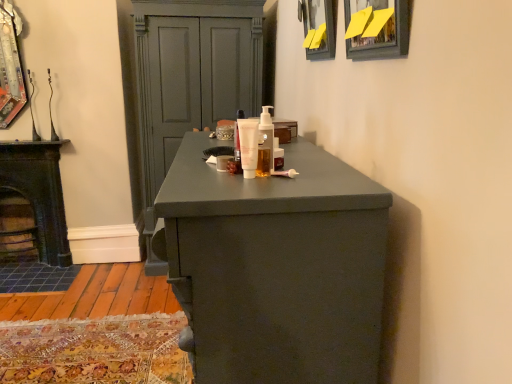
Question: Looking at their shapes, would you say black cast iron stove at left is wider or thinner than white matte tube at center?

Choices:
 (A) thin
 (B) wide

Answer: (B)

Question: Considering their positions, is black cast iron stove at left located in front of or behind white matte tube at center?

Choices:
 (A) behind
 (B) front

Answer: (A)

Question: Considering the real-world distances, which object is closest to the yellow paper at upper center, the second picture frame when ordered from back to front?

Choices:
 (A) white matte tube at center, the first mouthwash in the front-to-back sequence
 (B) white matte tube at center
 (C) matte gray chest of drawers at center
 (D) translucent plastic mouthwash at center, which is the 2th mouthwash from front to back
 (E) black cast iron stove at left

Answer: (D)

Question: Which object is positioned closest to the matte black picture frame at upper center, arranged as the 2th picture frame when viewed from the front?

Choices:
 (A) white matte tube at center
 (B) white matte tube at center, marked as the 2th mouthwash in a back-to-front arrangement
 (C) matte gray chest of drawers at center
 (D) black cast iron stove at left
 (E) yellow paper at upper center, the second picture frame when ordered from back to front

Answer: (E)